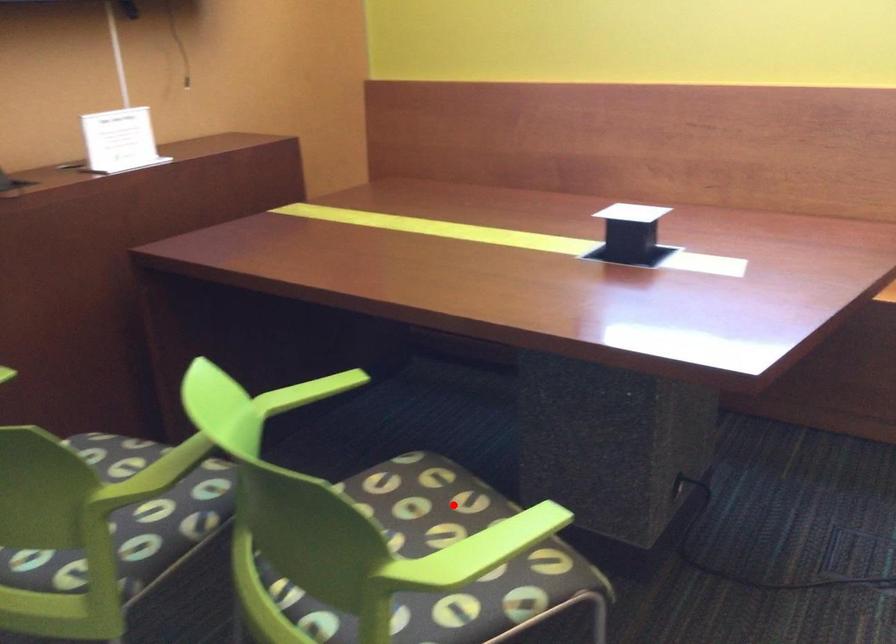
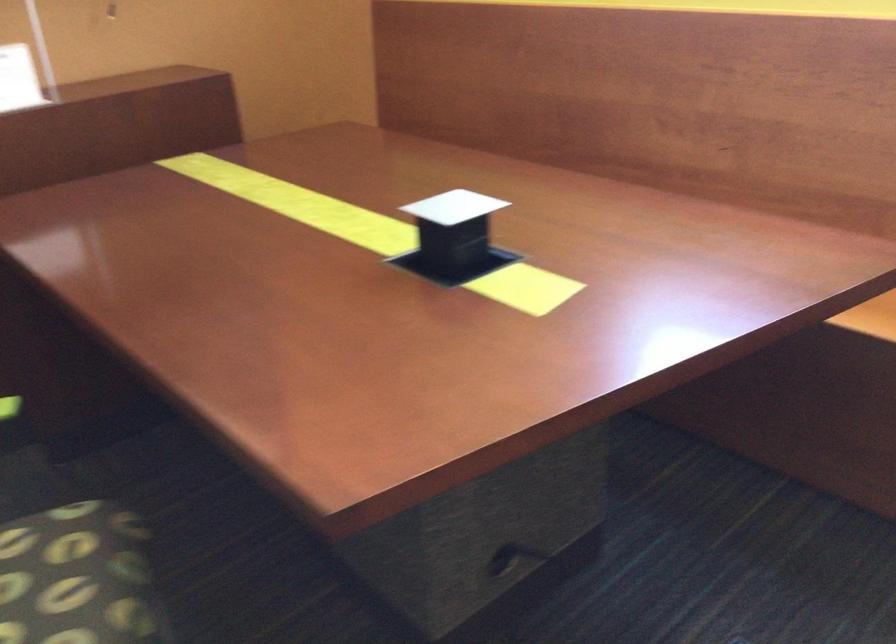
Question: I am providing you with two images of the same scene from different viewpoints. Image1 has a red point marked. In image2, the corresponding 3D location appears at what relative position? Reply with the corresponding letter.

Choices:
 (A) Closer
 (B) Farther

Answer: (A)